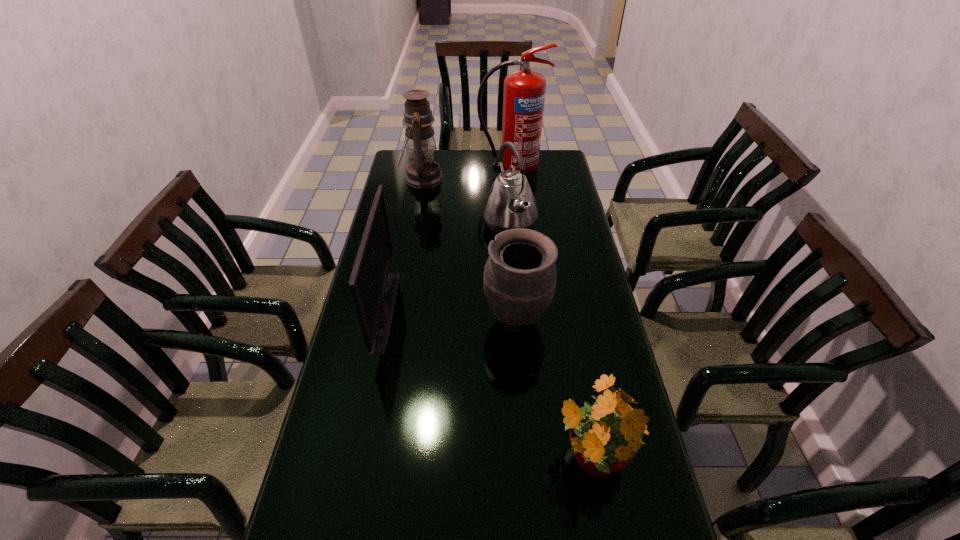
Image resolution: width=960 pixels, height=540 pixels. What are the coordinates of `the tallest object` in the screenshot? It's located at (524, 91).

You are a GUI agent. You are given a task and a screenshot of the screen. Output one action in this format:
    pyautogui.click(x=<x>, y=<y>)
    Task: Click on the oil lamp
    
    Given the screenshot: What is the action you would take?
    pyautogui.click(x=423, y=172)

Identify the location of the third farthest object. The image size is (960, 540). (510, 204).

Where is `monitor`? The height and width of the screenshot is (540, 960). monitor is located at coordinates click(374, 289).

Where is `urn`? The image size is (960, 540). urn is located at coordinates (520, 275).

Locate an element on the screen. the nearest object is located at coordinates (605, 435).

The image size is (960, 540). In order to click on vacant space positioned on the surface of the fire extinguisher in this screenshot , I will do `click(516, 228)`.

Image resolution: width=960 pixels, height=540 pixels. Identify the location of vacant point located 0.280m on the right of the oil lamp. click(x=507, y=178).

Where is `free location located on the front of the fourth nearest object`? free location located on the front of the fourth nearest object is located at coordinates (515, 301).

Identify the location of blank space located 0.160m on the front-facing side of the monitor. Image resolution: width=960 pixels, height=540 pixels. (445, 310).